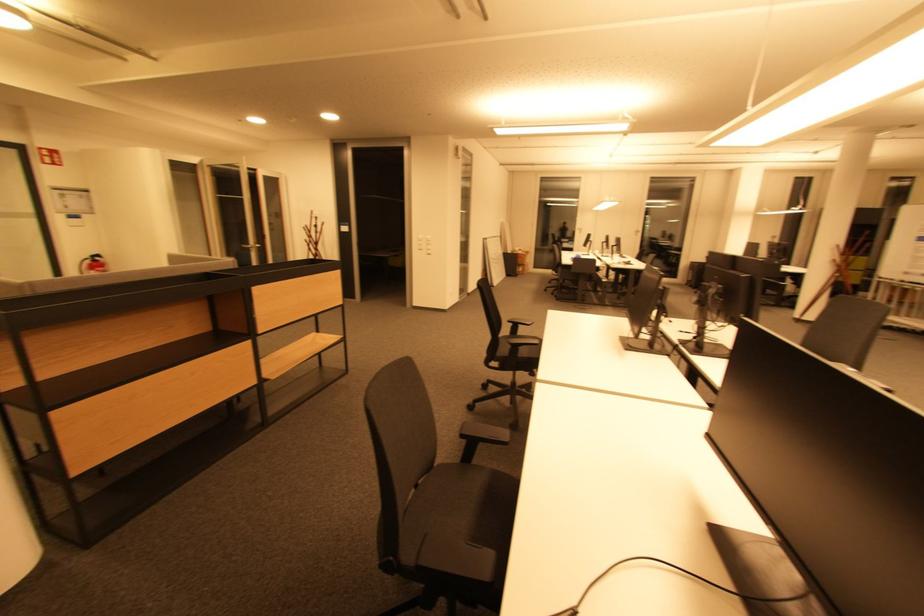
Identify the location of white light switch. The width and height of the screenshot is (924, 616). (423, 245).